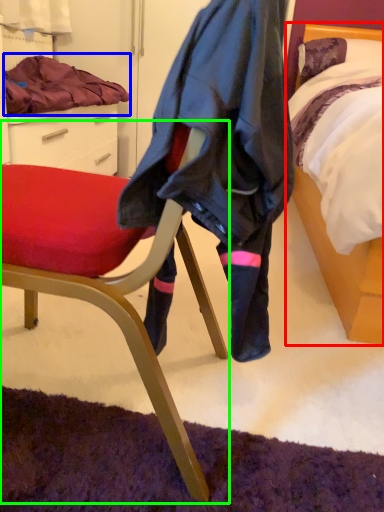
Question: Which object is positioned farthest from bed (highlighted by a red box)? Select from blanket (highlighted by a blue box) and chair (highlighted by a green box).

Choices:
 (A) blanket
 (B) chair

Answer: (A)